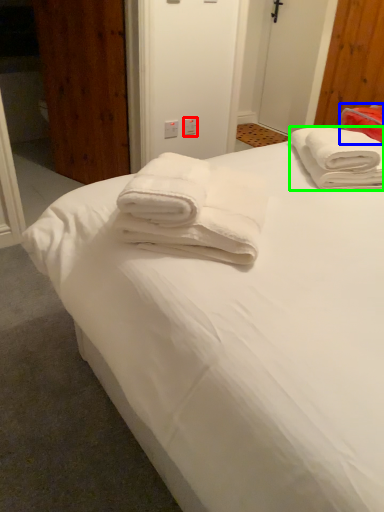
Question: Based on their relative distances, which object is nearer to electric outlet (highlighted by a red box)? Choose from cloth (highlighted by a blue box) and towel (highlighted by a green box).

Choices:
 (A) cloth
 (B) towel

Answer: (A)